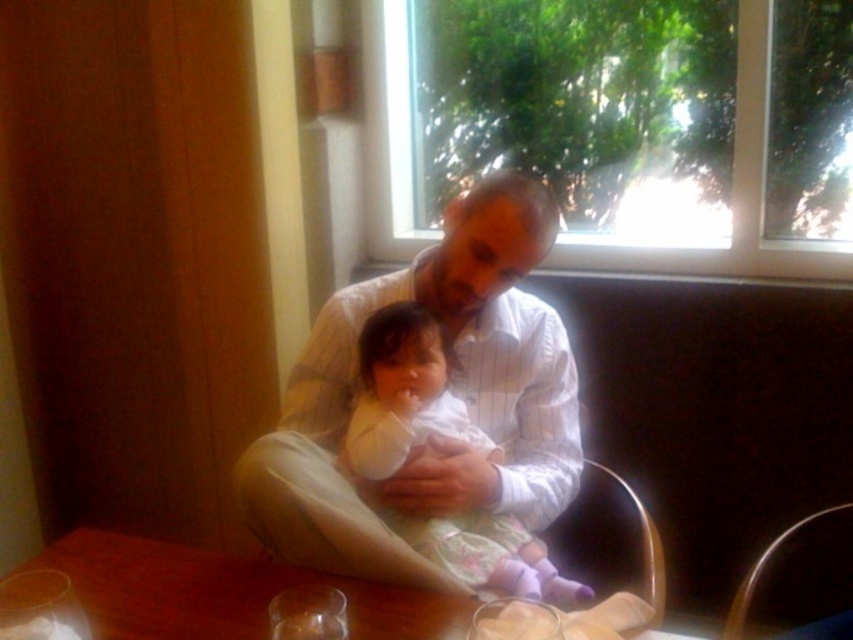
You are an interior designer assessing the placement of the white striped shirt at center in the scene. Based on its coordinates at point 0.614, 0.532, is it positioned closer to the left or right side of the image?

The white striped shirt at center is located at point (453, 392), which means it is positioned closer to the right side of the image since the x coordinate is above 0.5.

You are a photographer taking a picture of the scene. You want to ensure both the white striped shirt at center and the white soft fabric baby at center are clearly visible. Which object should you focus on first to ensure proper alignment?

You should focus on the white soft fabric baby at center first because the white striped shirt at center is to the right of it, so centering the baby first ensures both are in frame.

You are a photographer standing in the room. You need to capture a photo that includes both the white striped shirt at center and the brown wooden table at center. Which object should be placed closer to the camera to ensure both are fully visible in the frame?

The white striped shirt at center is taller than the brown wooden table at center, so to ensure both are fully visible in the frame, the brown wooden table at center should be placed closer to the camera.